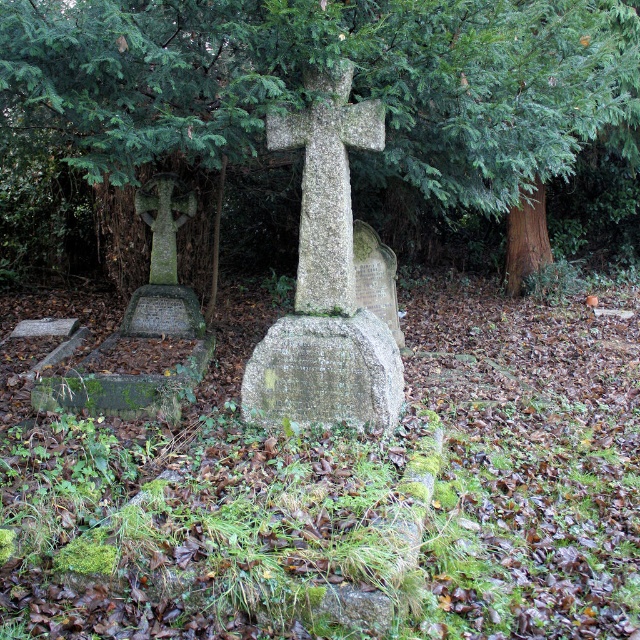
Question: Is granite gravestone at center below speckled stone cross at center?

Choices:
 (A) yes
 (B) no

Answer: (A)

Question: Which of the following is the closest to the observer?

Choices:
 (A) (259, 369)
 (B) (304, 296)

Answer: (A)

Question: Does green textured tree at center have a smaller size compared to granite gravestone at center?

Choices:
 (A) yes
 (B) no

Answer: (B)

Question: Which point is farther to the camera?

Choices:
 (A) speckled stone cross at center
 (B) granite gravestone at center

Answer: (B)

Question: Which of these objects is positioned closest to the green textured tree at center?

Choices:
 (A) speckled stone cross at center
 (B) granite gravestone at center

Answer: (A)

Question: Does green textured tree at center have a larger size compared to speckled stone cross at center?

Choices:
 (A) no
 (B) yes

Answer: (B)